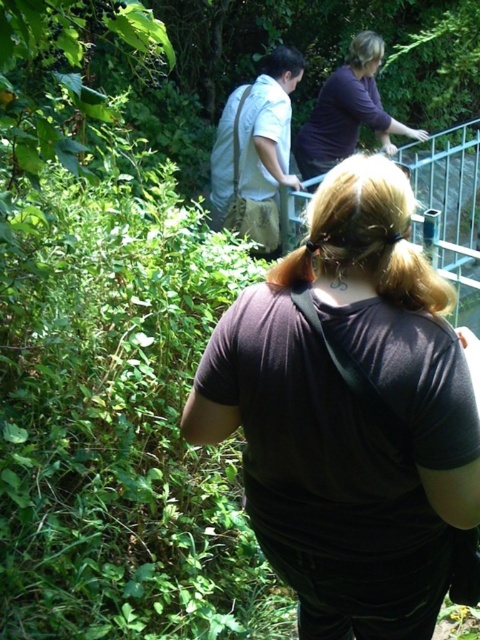
Which of these two, dark brown fabric at center or dark purple shirt at upper center, stands taller?

With more height is dark brown fabric at center.

Does dark brown fabric at center have a larger size compared to dark purple shirt at upper center?

No, dark brown fabric at center is not bigger than dark purple shirt at upper center.

What do you see at coordinates (350, 413) in the screenshot? I see `dark brown fabric at center` at bounding box center [350, 413].

The height and width of the screenshot is (640, 480). I want to click on dark brown fabric at center, so click(x=350, y=413).